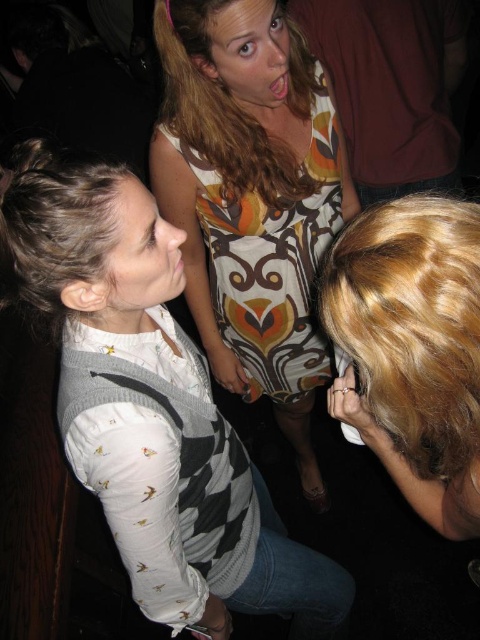
You are at point A located at point (279,10) and want to move to point B located at point (168,154). Considering the social setting in the image, would moving from point A to point B require passing in front of or behind the young girl in the white long sleeved shirt?

Point (168,154) is behind point (279,10), so moving from point A to point B would require passing behind the young girl in the white long sleeved shirt.

You are at a party and want to introduce yourself to the person with the blonde wavy hair at lower right. Which direction should you move from the printed fabric dress at center to reach them?

You should move to the right from the printed fabric dress at center to reach the blonde wavy hair at lower right since the printed fabric dress at center is to the left of blonde wavy hair at lower right.